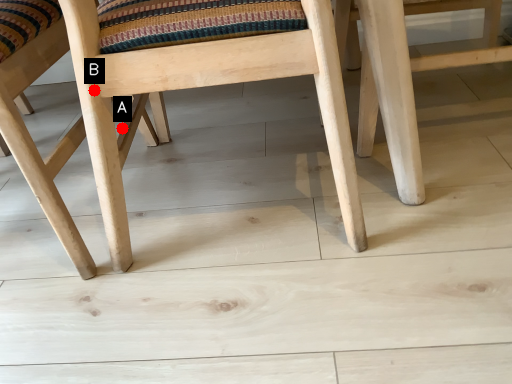
Question: Two points are circled on the image, labeled by A and B beside each circle. Which point is further to the camera?

Choices:
 (A) A is further
 (B) B is further

Answer: (A)